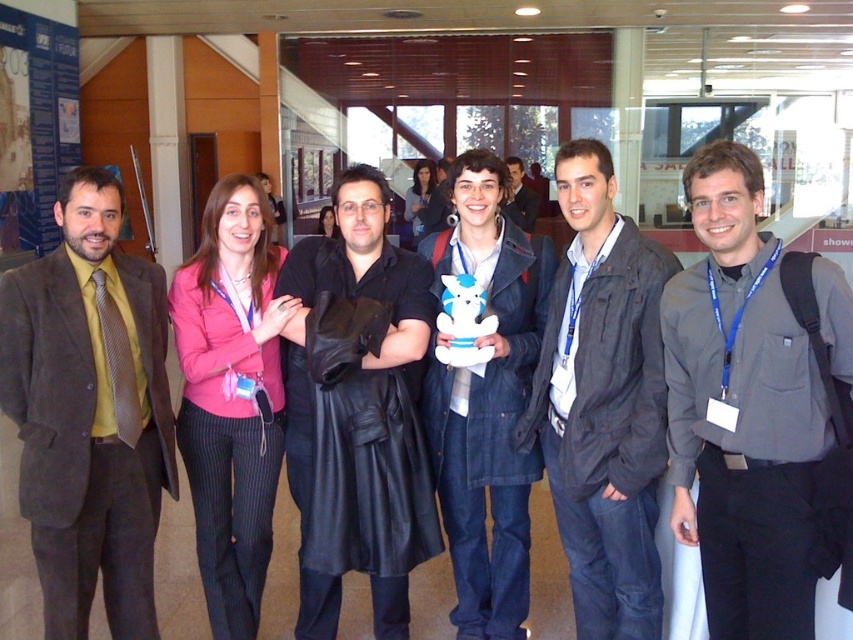
Question: Among these points, which one is farthest from the camera?

Choices:
 (A) (645, 496)
 (B) (494, 273)
 (C) (190, 406)
 (D) (90, 298)

Answer: (B)

Question: Which point is farther to the camera?

Choices:
 (A) (643, 317)
 (B) (245, 561)
 (C) (727, 636)
 (D) (520, 317)

Answer: (D)

Question: Does pink fabric jacket at center come in front of denim jacket at center?

Choices:
 (A) yes
 (B) no

Answer: (B)

Question: Does pink fabric jacket at center appear on the right side of matte black jacket at center?

Choices:
 (A) yes
 (B) no

Answer: (B)

Question: Can you confirm if suede brown suit at left is wider than pink fabric jacket at center?

Choices:
 (A) yes
 (B) no

Answer: (B)

Question: Among these objects, which one is farthest from the camera?

Choices:
 (A) suede brown suit at left
 (B) black leather coat at center

Answer: (B)